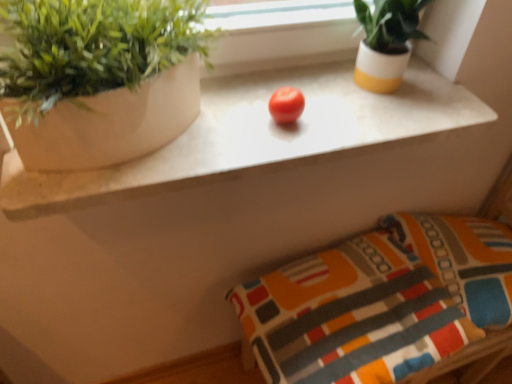
Identify the location of free area in between white glossy pot at upper right and red matte tomato at center. (331, 101).